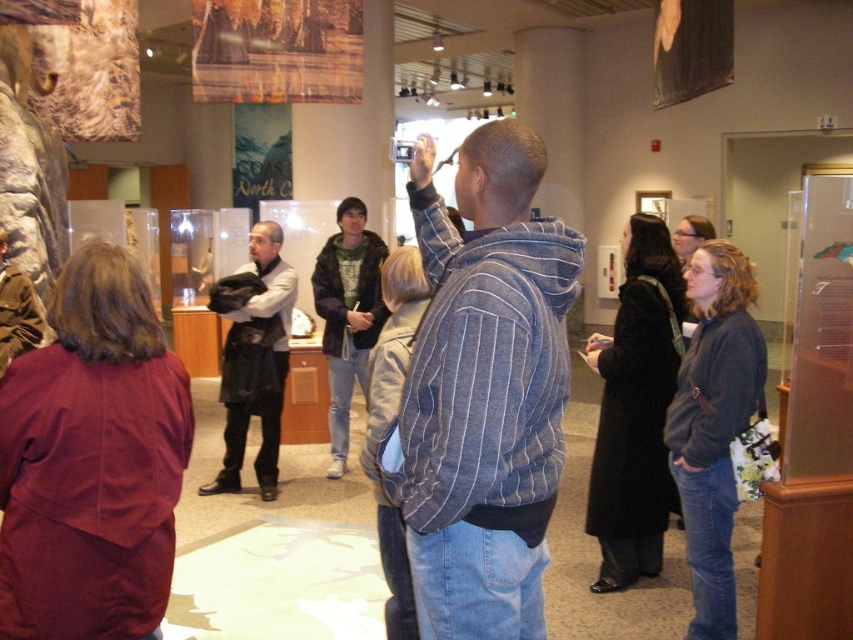
You are a fashion designer observing the two individuals at the center of the museum. You need to determine which clothing item has a narrower width between the striped denim jacket at center and the green hoodie at center. Which one is narrower?

The striped denim jacket at center is thinner than the green hoodie at center, so the striped denim jacket at center is narrower in width.

You are a photographer trying to capture both the dark gray fabric jacket at center and the green hoodie at center in the same frame. Which jacket should you adjust your camera angle to include first if you want to ensure both are visible?

The dark gray fabric jacket at center is positioned on the left side of green hoodie at center. To include both in the frame, adjust your camera angle to first ensure the dark gray fabric jacket at center on the left is visible, then frame the green hoodie at center on the right accordingly.

You are standing in the museum and want to take a photo of the striped denim jacket at center without anyone blocking your view. The person with the camera is 1.57 meters away from you. Can you move to a position where you can take the photo without the camera person blocking your view?

Yes, since the person with the camera is 1.57 meters away from the striped denim jacket at center, you can move to the side or behind them to capture the photo without obstruction.